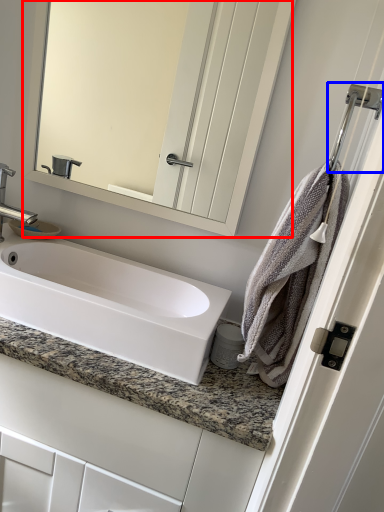
Question: Which object appears farthest to the camera in this image, mirror (highlighted by a red box) or shower (highlighted by a blue box)?

Choices:
 (A) mirror
 (B) shower

Answer: (A)